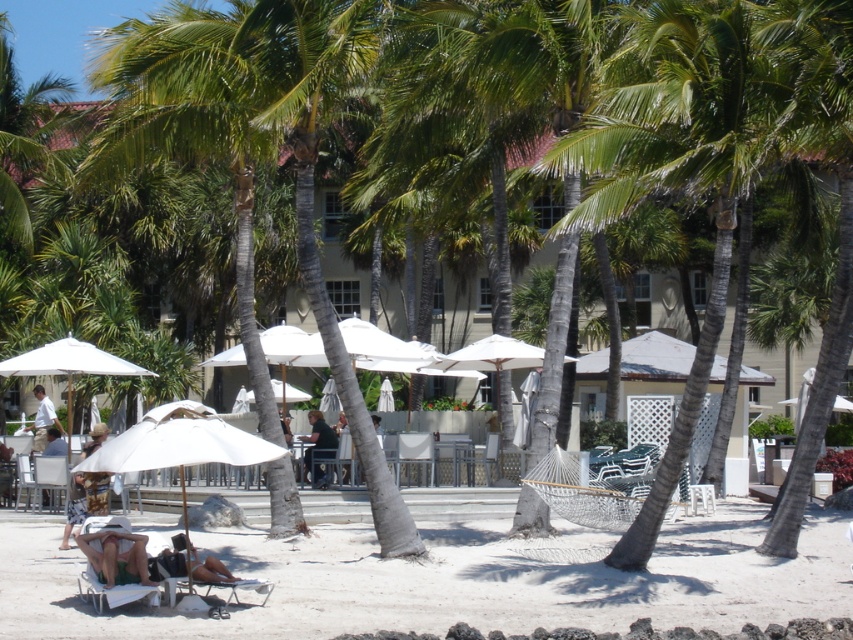
Question: Among these objects, which one is farthest from the camera?

Choices:
 (A) black fabric bikini at lower left
 (B) white matte umbrella at lower left
 (C) dark blue shirt at center
 (D) beige fabric beach chair at lower left

Answer: (C)

Question: Can you confirm if white sand at lower left is bigger than white fabric umbrella at left?

Choices:
 (A) no
 (B) yes

Answer: (B)

Question: Is white fabric umbrella at left bigger than dark blue shirt at center?

Choices:
 (A) no
 (B) yes

Answer: (A)

Question: Which object is positioned closest to the white sand at lower left?

Choices:
 (A) dark blue shirt at center
 (B) black fabric bikini at lower left
 (C) beige fabric beach chair at lower left

Answer: (C)

Question: Which point appears closest to the camera in this image?

Choices:
 (A) (183, 540)
 (B) (51, 406)
 (C) (810, 577)

Answer: (A)

Question: Does white sand at lower left have a greater width compared to white shirt at center?

Choices:
 (A) yes
 (B) no

Answer: (A)